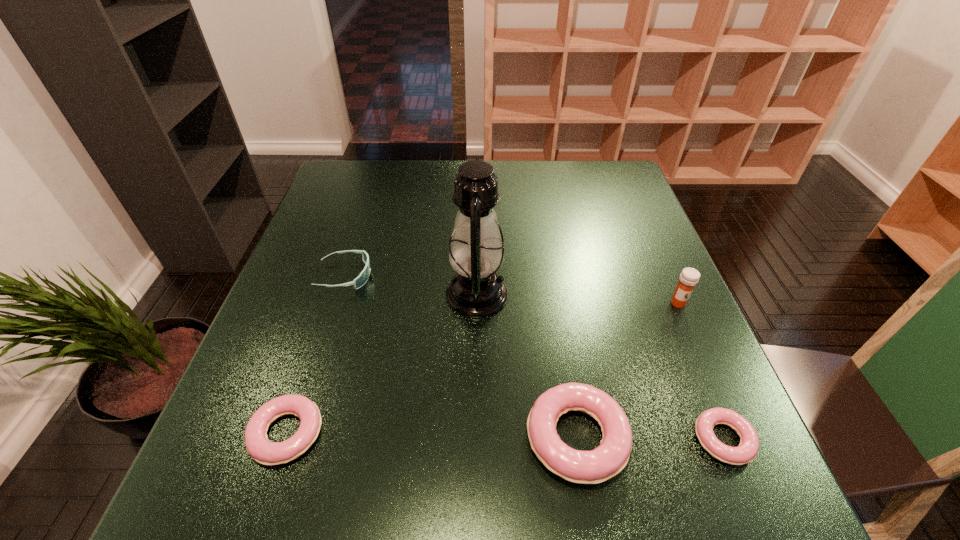
Identify the location of vacant space located on the back of the second doughnut from right to left. (554, 296).

Locate an element on the screen. This screenshot has height=540, width=960. blank space located 0.050m on the left of the shortest doughnut is located at coordinates (665, 440).

The height and width of the screenshot is (540, 960). In order to click on free region located 0.160m on the front-facing side of the goggles in this screenshot , I will do `click(439, 276)`.

Where is `free point located 0.230m on the label side of the fifth shortest object`? This screenshot has height=540, width=960. free point located 0.230m on the label side of the fifth shortest object is located at coordinates (722, 402).

Where is `vacant space located on the right of the tallest object`? This screenshot has width=960, height=540. vacant space located on the right of the tallest object is located at coordinates (657, 295).

Where is `doughnut that is at the left edge`? The width and height of the screenshot is (960, 540). doughnut that is at the left edge is located at coordinates (259, 447).

Identify the location of goggles located in the left edge section of the desktop. (358, 282).

Identify the location of doughnut that is at the right edge. (747, 450).

Identify the location of medicine that is at the right edge. (689, 277).

Image resolution: width=960 pixels, height=540 pixels. I want to click on object that is at the near left corner, so click(x=259, y=447).